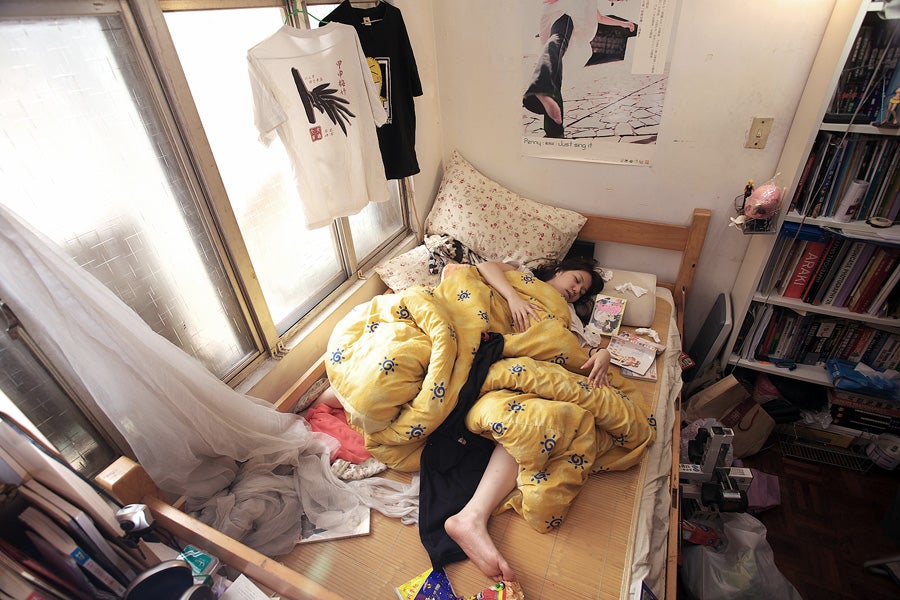
Locate an element on the screen. Image resolution: width=900 pixels, height=600 pixels. bamboo mat is located at coordinates (576, 550).